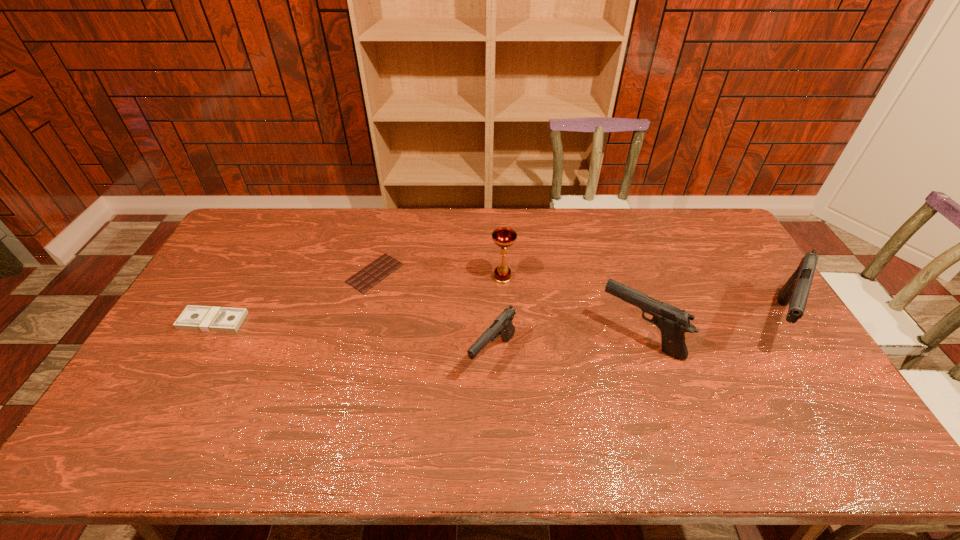
This screenshot has width=960, height=540. I want to click on free spot that satisfies the following two spatial constraints: 1. at the muzzle of the second object from right to left; 2. at the muzzle of the shortest gun, so click(x=645, y=355).

This screenshot has width=960, height=540. In order to click on vacant space that satisfies the following two spatial constraints: 1. at the muzzle of the rightmost object; 2. at the muzzle of the second gun from left to right in this screenshot , I will do `click(786, 338)`.

This screenshot has width=960, height=540. I want to click on free space that satisfies the following two spatial constraints: 1. at the muzzle of the rightmost gun; 2. at the muzzle of the second tallest gun, so click(x=786, y=338).